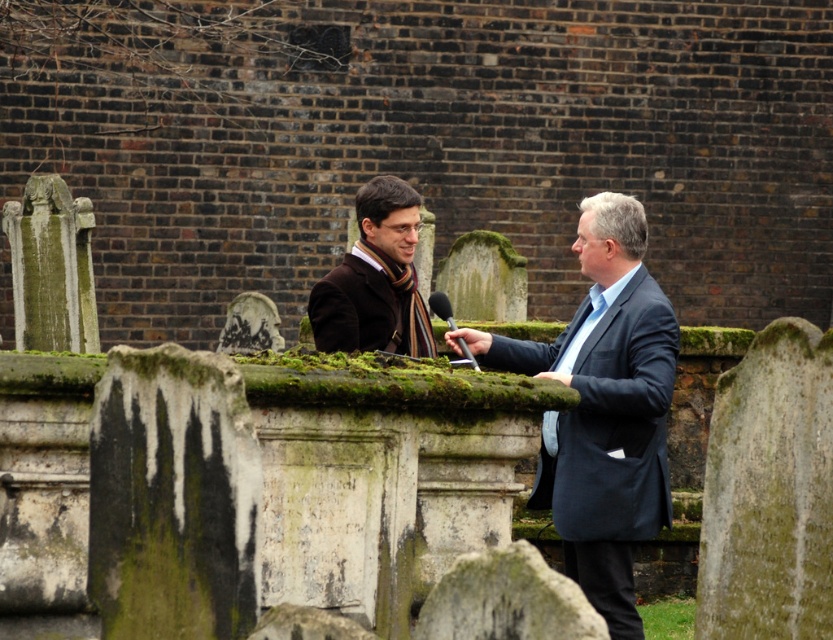
You are a photographer positioned behind the dark blue suit at center and the metallic silver microphone at center. You want to take a photo of the microphone without the suit blocking it. Can you move backward to achieve this?

The dark blue suit at center is closer to the viewer than the metallic silver microphone at center. Moving backward would increase the distance between you and both objects, but since the suit is already in front of the microphone, moving backward might not prevent the suit from blocking the microphone. You might need to adjust your angle instead.

You are a photographer standing at the point marked by the coordinates point (x=375, y=280). You want to take a photo of the matte brown coat at center. Since you are at the point, will you be able to see the matte brown coat at center in your camera frame?

Yes, since the point (x=375, y=280) indicates the location of the matte brown coat at center, you are already positioned at the exact coordinates where the matte brown coat at center is located. Therefore, you can clearly see it in your camera frame.

You are a photographer positioned to the left of the two individuals in the image. You need to take a photo that includes both the dark blue suit at center and the matte brown coat at center. Which person should you position closer to the left side of the frame to ensure both are fully visible?

You should position the matte brown coat at center closer to the left side of the frame since it is to the left of the dark blue suit at center, ensuring both are fully visible in the photo.